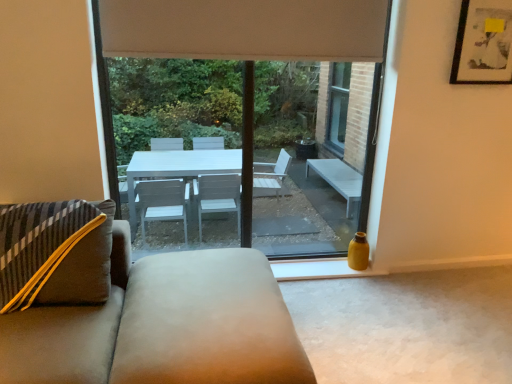
Question: From a real-world perspective, is suede ottoman at center positioned over matte black picture frame at upper right based on gravity?

Choices:
 (A) yes
 (B) no

Answer: (B)

Question: Considering the relative positions of suede ottoman at center and matte black picture frame at upper right in the image provided, is suede ottoman at center to the left of matte black picture frame at upper right from the viewer's perspective?

Choices:
 (A) no
 (B) yes

Answer: (B)

Question: Is suede ottoman at center positioned behind matte black picture frame at upper right?

Choices:
 (A) yes
 (B) no

Answer: (B)

Question: Can you confirm if suede ottoman at center is shorter than matte black picture frame at upper right?

Choices:
 (A) yes
 (B) no

Answer: (A)

Question: Considering the relative sizes of suede ottoman at center and matte black picture frame at upper right in the image provided, is suede ottoman at center smaller than matte black picture frame at upper right?

Choices:
 (A) yes
 (B) no

Answer: (B)

Question: Considering the relative sizes of suede ottoman at center and matte black picture frame at upper right in the image provided, is suede ottoman at center thinner than matte black picture frame at upper right?

Choices:
 (A) yes
 (B) no

Answer: (B)

Question: Does suede ottoman at center have a lesser height compared to transparent glass window at center?

Choices:
 (A) yes
 (B) no

Answer: (A)

Question: Are suede ottoman at center and transparent glass window at center beside each other?

Choices:
 (A) yes
 (B) no

Answer: (B)

Question: Is suede ottoman at center aimed at transparent glass window at center?

Choices:
 (A) yes
 (B) no

Answer: (B)

Question: From the image's perspective, is suede ottoman at center on top of transparent glass window at center?

Choices:
 (A) yes
 (B) no

Answer: (B)

Question: Can you confirm if suede ottoman at center is taller than transparent glass window at center?

Choices:
 (A) yes
 (B) no

Answer: (B)

Question: Is suede ottoman at center positioned with its back to transparent glass window at center?

Choices:
 (A) no
 (B) yes

Answer: (B)

Question: Considering the relative sizes of matte black picture frame at upper right and transparent glass window at center in the image provided, is matte black picture frame at upper right taller than transparent glass window at center?

Choices:
 (A) yes
 (B) no

Answer: (B)